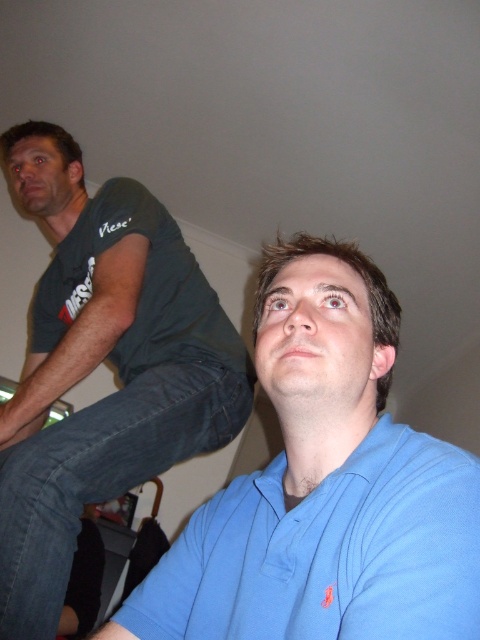
Question: Is blue cotton shirt at lower right positioned behind dark green t-shirt at left?

Choices:
 (A) no
 (B) yes

Answer: (A)

Question: Which point is closer to the camera taking this photo?

Choices:
 (A) (144, 468)
 (B) (286, 609)

Answer: (B)

Question: Is blue cotton shirt at lower right positioned before dark green t-shirt at left?

Choices:
 (A) yes
 (B) no

Answer: (A)

Question: Which point is closer to the camera taking this photo?

Choices:
 (A) (175, 250)
 (B) (240, 564)

Answer: (B)

Question: Is blue cotton shirt at lower right thinner than dark green t-shirt at left?

Choices:
 (A) yes
 (B) no

Answer: (A)